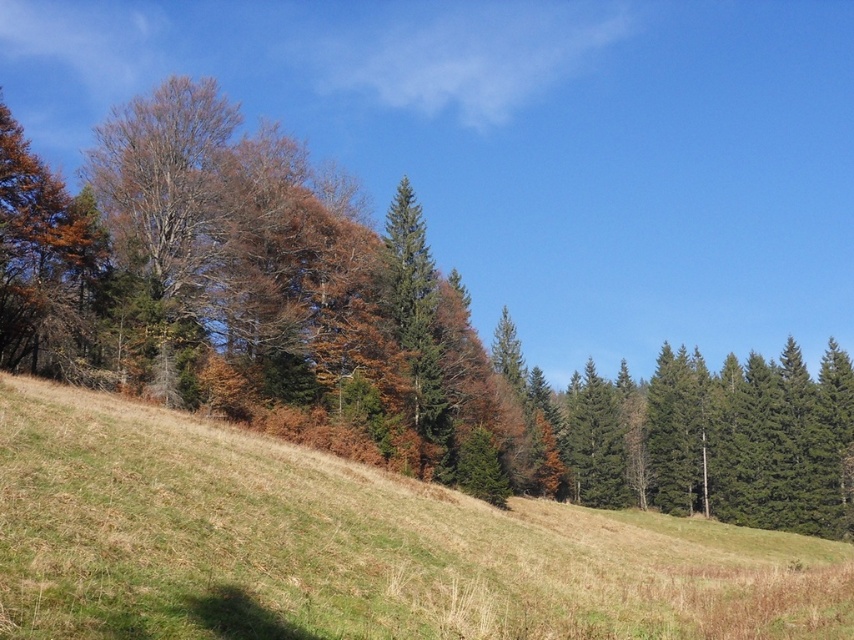
You are planning to plant a new tree in this landscape. The new tree requires a minimum of 80 feet of space between it and any existing trees to thrive. If you want to place the new tree between the brown matte tree at left and the brown grassy hillside at center, will there be enough space?

The brown matte tree at left and brown grassy hillside at center are 75.53 feet apart. Since the required minimum space is 80 feet, the distance between them is insufficient. Therefore, placing the new tree between them would not meet the space requirement.

Based on the photo, you are standing at the center of the image and want to locate the brown matte tree at left. In which direction should you look?

The brown matte tree at left is located at point coordinates 0.522 on the x axis and 0.438 on the y axis. Since the coordinate system is normalized, with the origin at the bottom left corner of the image, the x value of 0.522 indicates it is slightly to the right of the center horizontally, and the y value of 0.438 places it above the bottom edge but below the center vertically. Therefore, to locate the brown matte tree at left, you should look slightly to the right and upwards from the bottom center of the